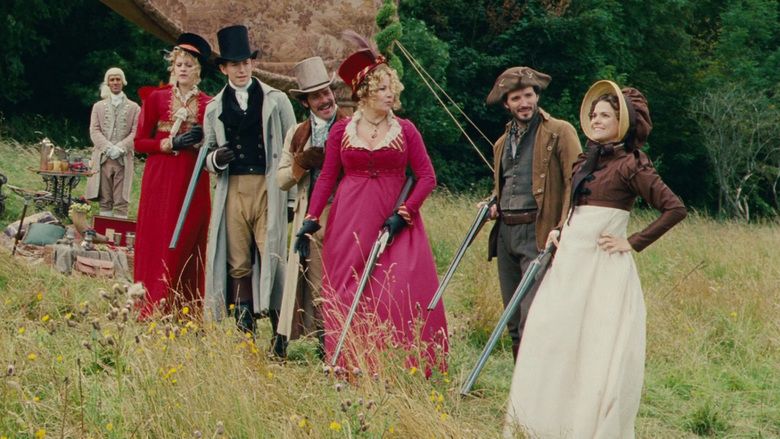
Image resolution: width=780 pixels, height=439 pixels. Find the location of `blanket`. blanket is located at coordinates (289, 35).